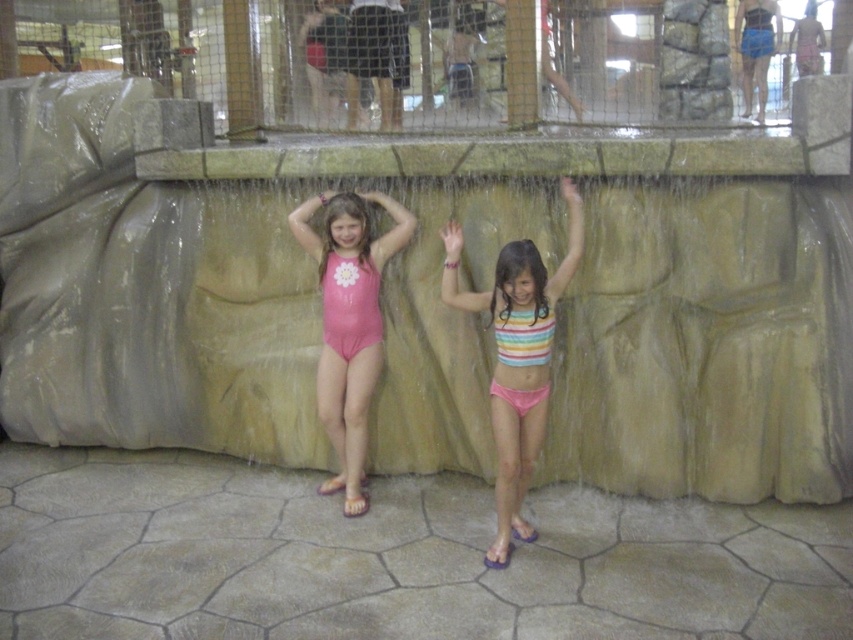
You are a lifeguard at the water park and need to ensure swimwear meets safety standards. According to the image, which swimwear item is larger in size between the rainbow striped bikini top at center and the pink rubber swimsuit at center?

The rainbow striped bikini top at center is larger in size than the pink rubber swimsuit at center.

You are a photographer positioned at the camera location. You want to capture a clear photo of the rainbow striped bikini top at center. Considering the glass barrier between you and the subject, will you be able to focus on the bikini top without any obstructions?

The rainbow striped bikini top at center is 4.66 meters away from camera. Since the glass barrier is between you and the subject, it may cause reflections or distortions in the photo. However, the distance allows for proper focusing, so with careful adjustment, you can likely capture a clear image without major obstructions.